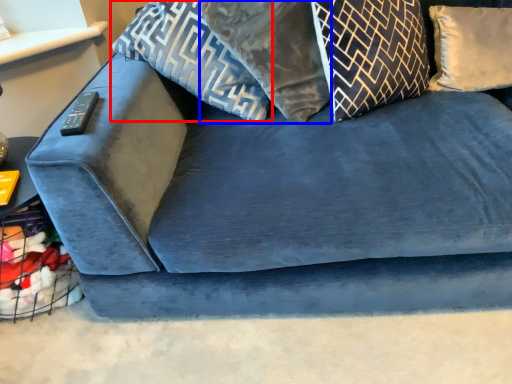
Question: Among these objects, which one is farthest to the camera, pillow (highlighted by a red box) or pillow (highlighted by a blue box)?

Choices:
 (A) pillow
 (B) pillow

Answer: (A)